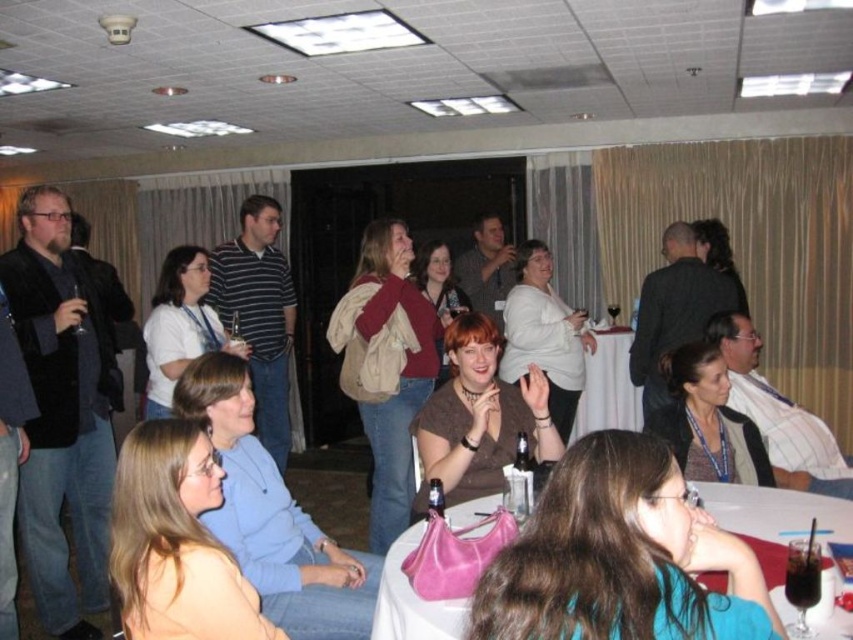
Question: Based on their relative distances, which object is nearer to the white tablecloth at center?

Choices:
 (A) clear glass wine glass at left
 (B) beige canvas backpack at center
 (C) translucent plastic bottle at center

Answer: (B)

Question: Which of the following is the closest to the observer?

Choices:
 (A) (799, 531)
 (B) (372, 321)
 (C) (595, 333)
 (D) (619, 308)

Answer: (A)

Question: Is clear plastic bottle at center to the left of clear glass wine glass at upper center from the viewer's perspective?

Choices:
 (A) yes
 (B) no

Answer: (A)

Question: Which point is farther from the camera taking this photo?

Choices:
 (A) (154, 387)
 (B) (39, 243)
 (C) (709, 449)

Answer: (A)

Question: Is white plastic table at lower right bigger than white tablecloth at center?

Choices:
 (A) yes
 (B) no

Answer: (B)

Question: Can you confirm if striped cotton shirt at center is positioned to the left of translucent plastic bottle at center?

Choices:
 (A) no
 (B) yes

Answer: (B)